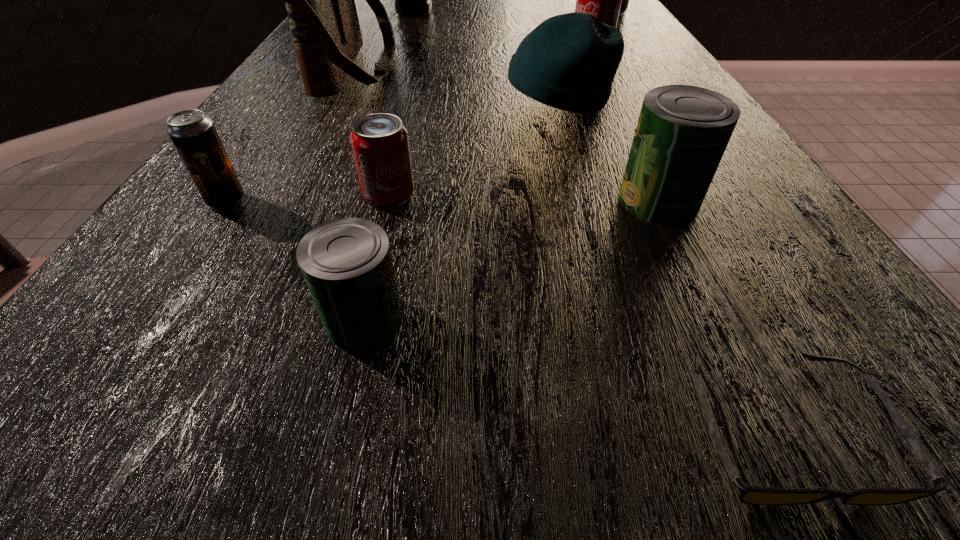
Where is `empty location between the tallest object and the second farthest red can`? The image size is (960, 540). empty location between the tallest object and the second farthest red can is located at coordinates (503, 28).

This screenshot has width=960, height=540. What are the coordinates of `vacant area between the nearest red can and the farther green can` in the screenshot? It's located at (524, 197).

This screenshot has height=540, width=960. What are the coordinates of `blank region between the shoulder bag and the second farthest can` in the screenshot? It's located at (475, 57).

Find the location of a particular element. This screenshot has width=960, height=540. empty space between the biggest red can and the tallest object is located at coordinates (510, 11).

This screenshot has height=540, width=960. What are the coordinates of `free space between the tallest object and the black beer can` in the screenshot? It's located at (321, 106).

Image resolution: width=960 pixels, height=540 pixels. I want to click on vacant region between the nearest can and the nearest object, so click(571, 372).

Identify which object is located as the second nearest to the black liquor. Please provide its 2D coordinates. Your answer should be formatted as a tuple, i.e. [(x, y)], where the tuple contains the x and y coordinates of a point satisfying the conditions above.

[(603, 0)]

Identify which object is located as the second nearest to the second nearest red can. Please provide its 2D coordinates. Your answer should be formatted as a tuple, i.e. [(x, y)], where the tuple contains the x and y coordinates of a point satisfying the conditions above.

[(625, 0)]

This screenshot has height=540, width=960. I want to click on can that stands as the fourth closest to the beer can, so click(x=603, y=0).

This screenshot has height=540, width=960. I want to click on the third closest can to the black sunglasses, so click(380, 143).